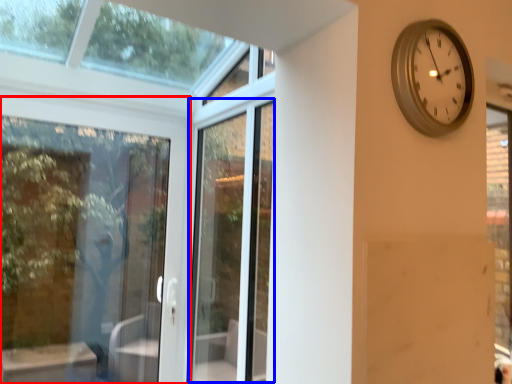
Question: Among these objects, which one is farthest to the camera, door (highlighted by a red box) or screen door (highlighted by a blue box)?

Choices:
 (A) door
 (B) screen door

Answer: (A)